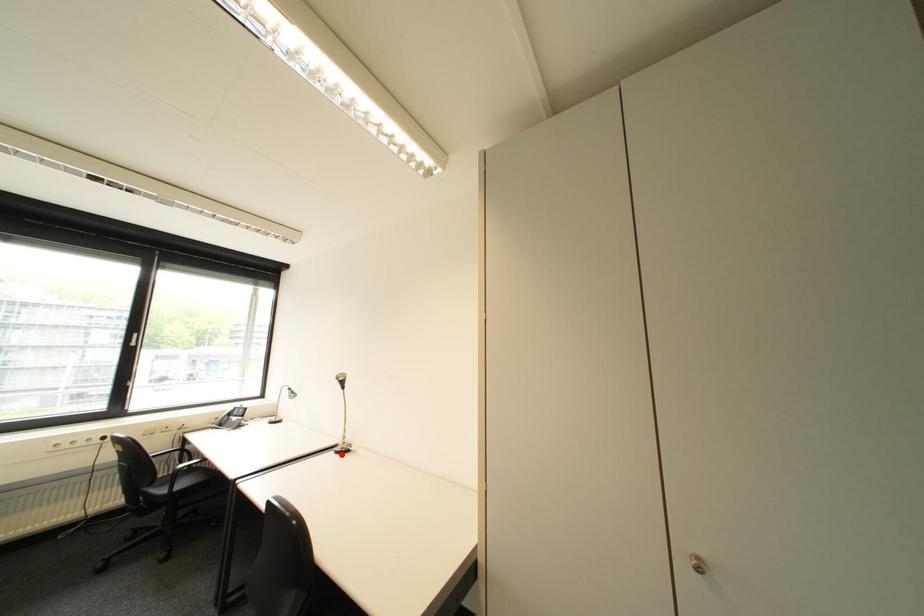
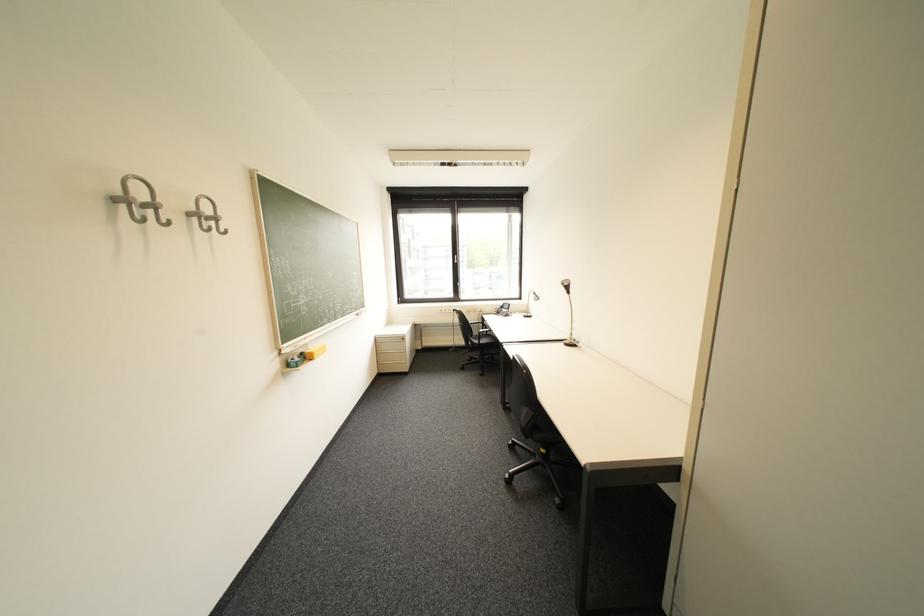
In the second image, find the point that corresponds to the highlighted location in the first image.

(572, 345)